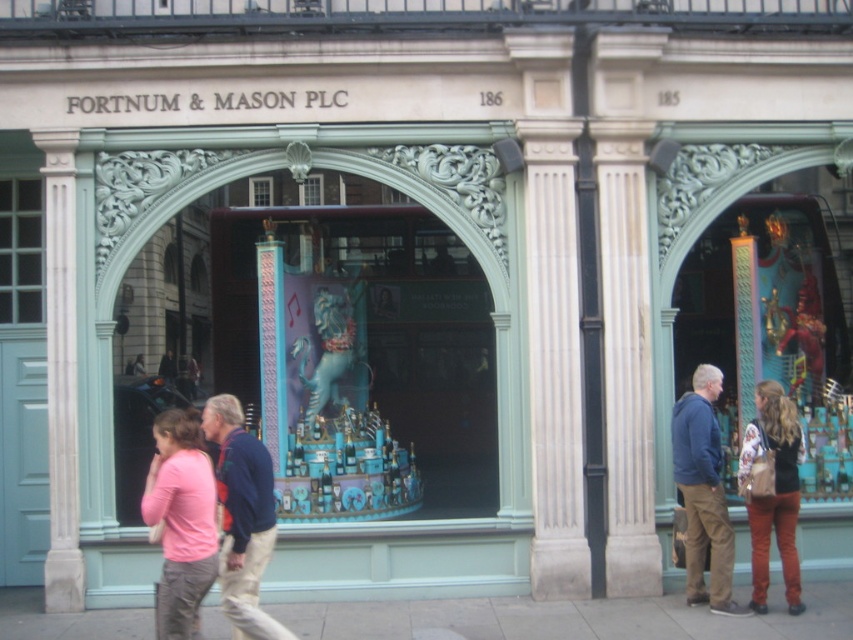
You are standing on the smooth concrete sidewalk at lower center at point (567,618). If you walk forward, will you eventually reach the entrance of Fortnum and Mason PLC?

Yes, the smooth concrete sidewalk at lower center is located at point (567,618), so walking forward along it will lead you towards the entrance of Fortnum and Mason PLC.